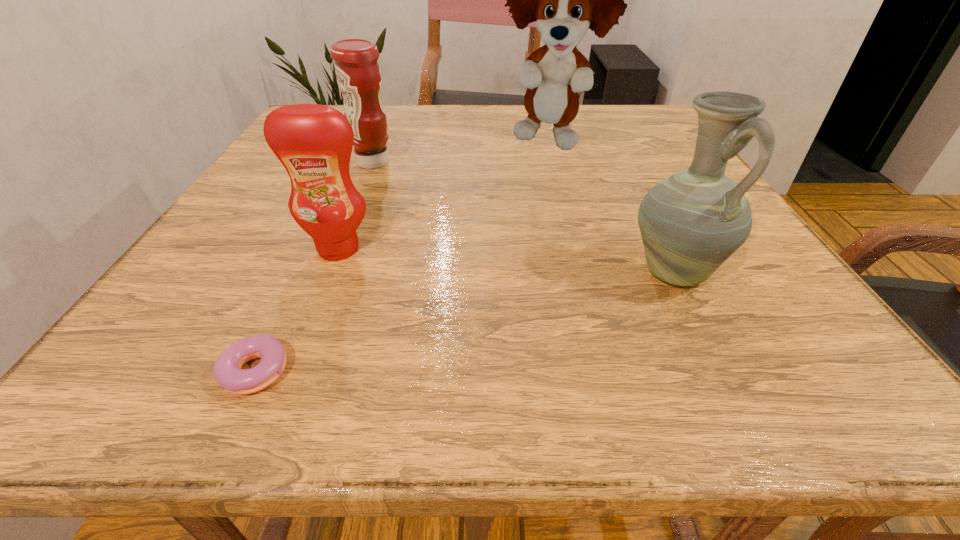
What are the coordinates of `the tallest object` in the screenshot? It's located at (565, 0).

Image resolution: width=960 pixels, height=540 pixels. In order to click on pitcher in this screenshot , I will do `click(691, 222)`.

Identify the location of the farther condiment. (358, 75).

This screenshot has width=960, height=540. I want to click on the nearer condiment, so click(x=314, y=142).

Where is `the shortest object`? the shortest object is located at coordinates (227, 371).

What are the coordinates of `the nearest object` in the screenshot? It's located at (227, 371).

Locate an element on the screen. vacant space situated on the face of the tallest object is located at coordinates (570, 224).

At what (x,y) coordinates should I click in order to perform the action: click on free region located 0.110m on the handle side of the pitcher. Please return your answer as a coordinate pair (x, y). This screenshot has height=540, width=960. Looking at the image, I should click on 720,364.

You are a GUI agent. You are given a task and a screenshot of the screen. Output one action in this format:
    pyautogui.click(x=<x>, y=<y>)
    Task: Click on the free space located on the front of the farther condiment
    
    Given the screenshot: What is the action you would take?
    pyautogui.click(x=345, y=233)

Where is `vacant region located 0.240m on the label side of the nearer condiment`? The width and height of the screenshot is (960, 540). vacant region located 0.240m on the label side of the nearer condiment is located at coordinates (285, 383).